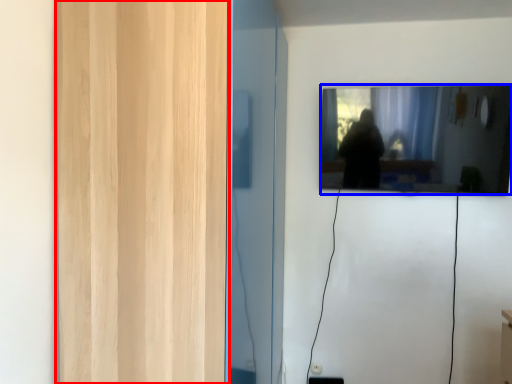
Question: Among these objects, which one is nearest to the camera, glass door (highlighted by a red box) or mirror (highlighted by a blue box)?

Choices:
 (A) glass door
 (B) mirror

Answer: (A)